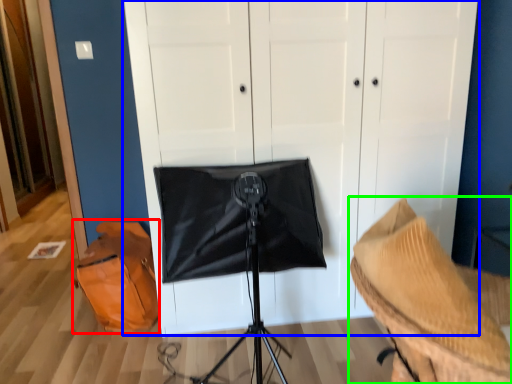
Question: Based on their relative distances, which object is farther from messenger bag (highlighted by a red box)? Choose from dresser (highlighted by a blue box) and furniture (highlighted by a green box).

Choices:
 (A) dresser
 (B) furniture

Answer: (B)